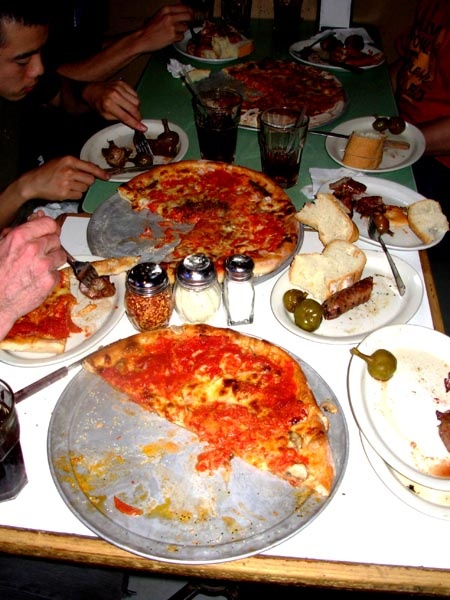
Identify the location of tabletop. (376, 519).